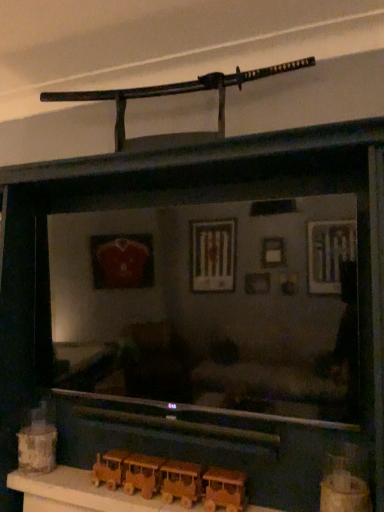
The width and height of the screenshot is (384, 512). What are the coordinates of `vacant region to the right of wooden toy train at lower left, which is counted as the 3th toy, starting from the front` in the screenshot? It's located at (67, 479).